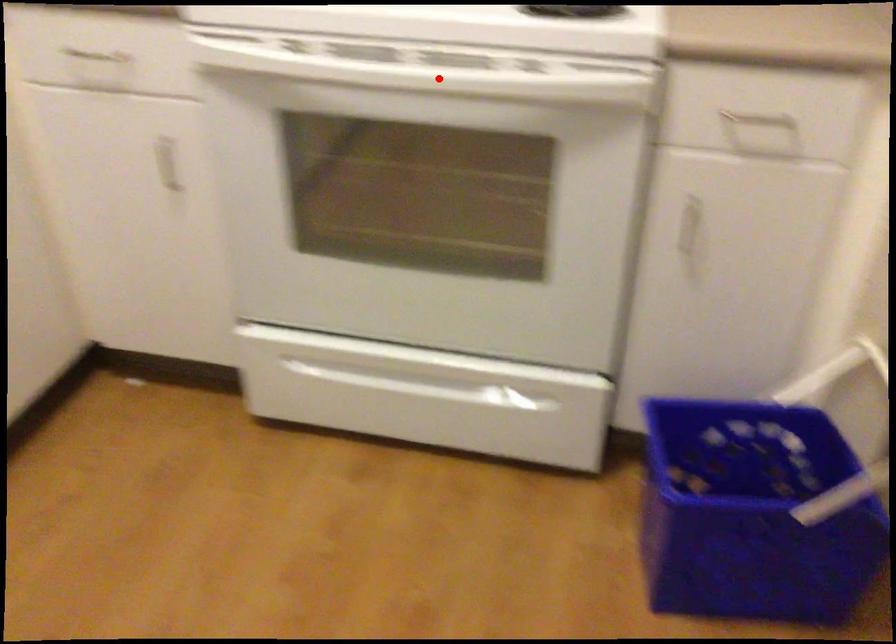
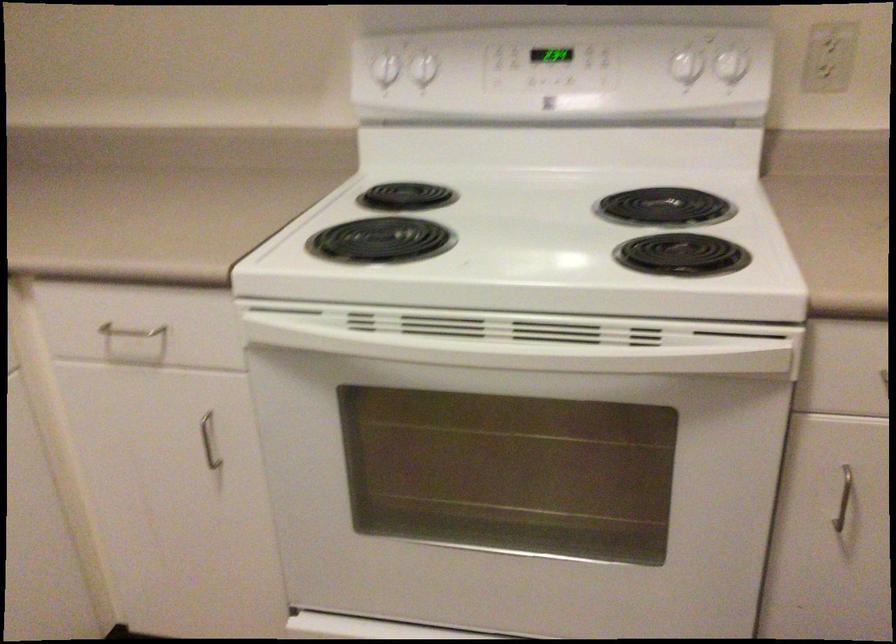
Question: I am providing you with two images of the same scene from different viewpoints. Image1 has a red point marked. In image2, the corresponding 3D location appears at what relative position? Reply with the corresponding letter.

Choices:
 (A) Closer
 (B) Farther

Answer: (A)